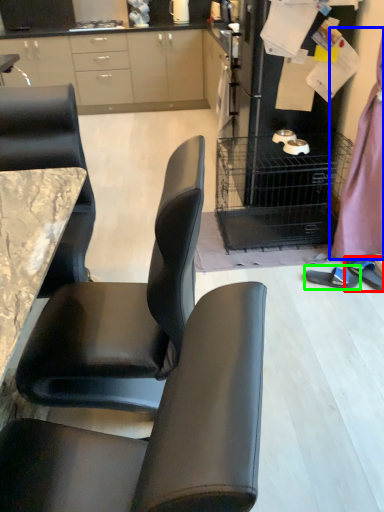
Question: Which object is the closest to the footwear (highlighted by a red box)? Choose among these: dress (highlighted by a blue box) or footwear (highlighted by a green box).

Choices:
 (A) dress
 (B) footwear

Answer: (B)